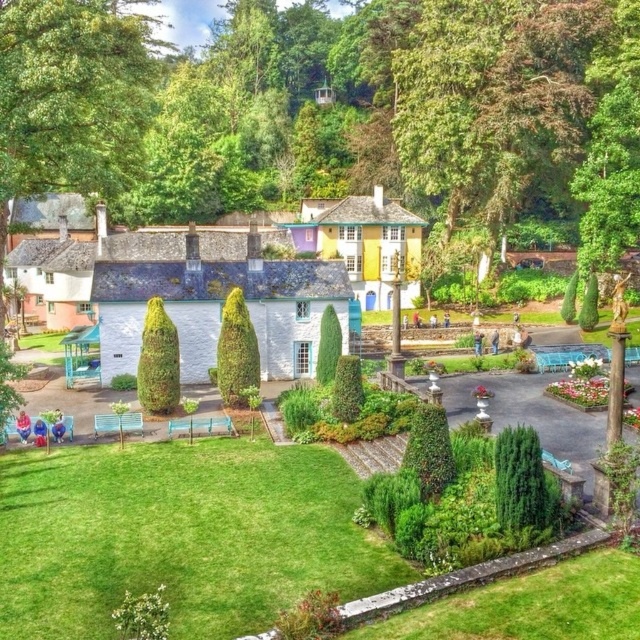
You are standing at the entrance of the garden and want to reach the fountain. According to the image, where is the green grass at lower center located in relation to your current position?

The green grass at lower center is located at point 0.838 on the x axis and 0.280 on the y axis, so it is positioned to the right and slightly forward from your current position at the entrance.

You are standing in the garden and want to walk from the fountain to the nearest bench. The fountain is located at point (316, 497) and the bench is at point (252, 333). Which direction should you walk to get closer to the bench?

You should walk towards point (252, 333) because it is farther from the viewer compared to point (316, 497), meaning the bench is behind the fountain in this perspective.